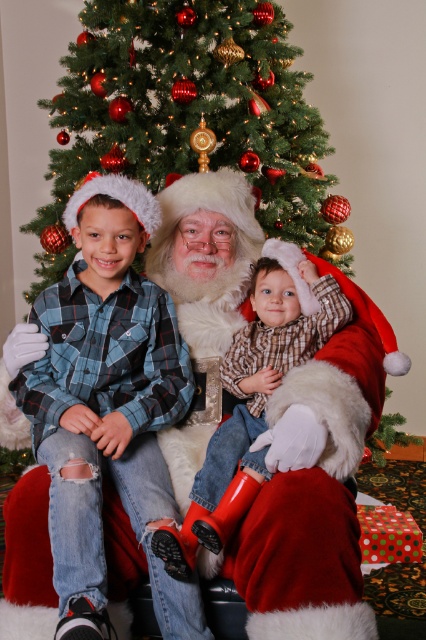
You are standing in the living room where Santa is seated between two children. You notice a blue plaid shirt at center. Can you confirm if the blue plaid shirt at center is located exactly at the coordinates point [108,404]?

Yes, the blue plaid shirt at center is located exactly at the coordinates point [108,404] according to the provided information.

You are a photographer taking a picture of Santa Claus and the two children. You notice the blue plaid shirt at center and the plaid flannel shirt at center. Which shirt should you adjust to avoid blocking Santa Claus in the middle?

The blue plaid shirt at center is positioned on the left side of plaid flannel shirt at center, so adjusting the plaid flannel shirt at center would be necessary to avoid blocking Santa Claus in the middle.

You are a photographer trying to capture a photo of Santa Claus and the children. You notice the blue plaid shirt at center and the green textured christmas tree at upper center. Which object is located higher in the image?

The green textured christmas tree at upper center is located higher in the image than the blue plaid shirt at center.